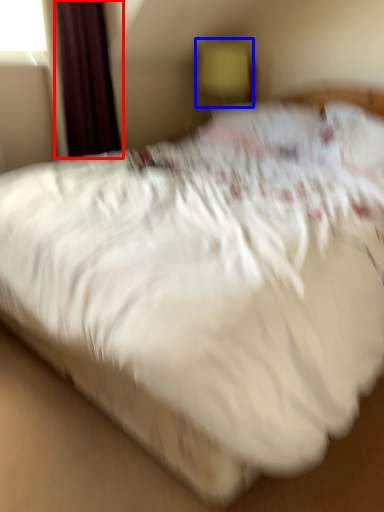
Question: Which of the following is the closest to the observer, curtain (highlighted by a red box) or table lamp (highlighted by a blue box)?

Choices:
 (A) curtain
 (B) table lamp

Answer: (A)